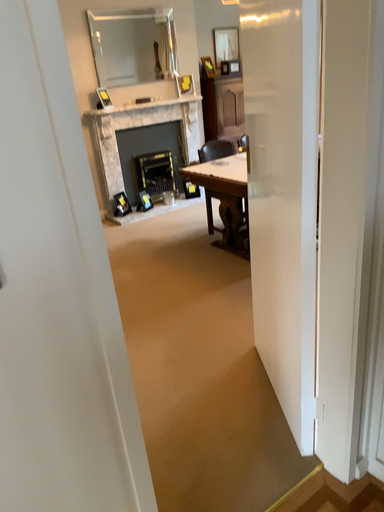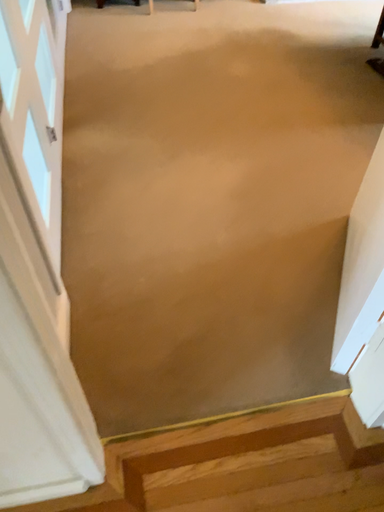
Question: Which way did the camera rotate in the video?

Choices:
 (A) rotated upward
 (B) rotated downward

Answer: (B)